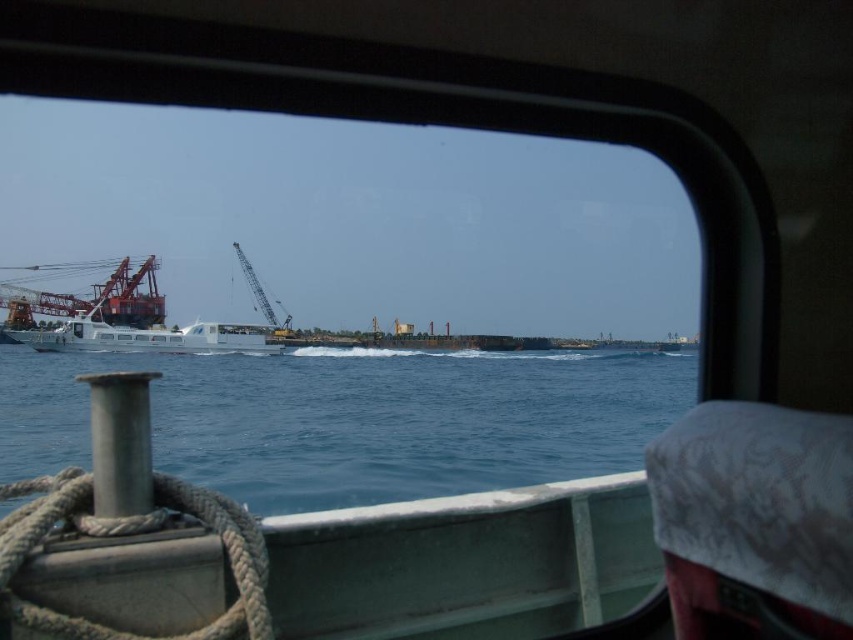
You are a delivery person on a boat and need to place a 5 meter long package between the blue water at center and the edge of the boat. Is there enough space?

The distance between the blue water at center and the edge of the boat is 5.15 meters. Since the package is 5 meters long, there is enough space to place it between them with 0.15 meters to spare.

In the scene shown: You are a sailor on a boat and need to determine if you can safely maneuver your vessel between the blue water at center and the white glossy boat at left. The boat you are on is 50 feet long. According to the scene, can your boat fit in the space between them?

The distance between the blue water at center and the white glossy boat at left is 58.00 feet, which is greater than your boat length of 50 feet. Therefore, your boat can safely fit in the space between them.